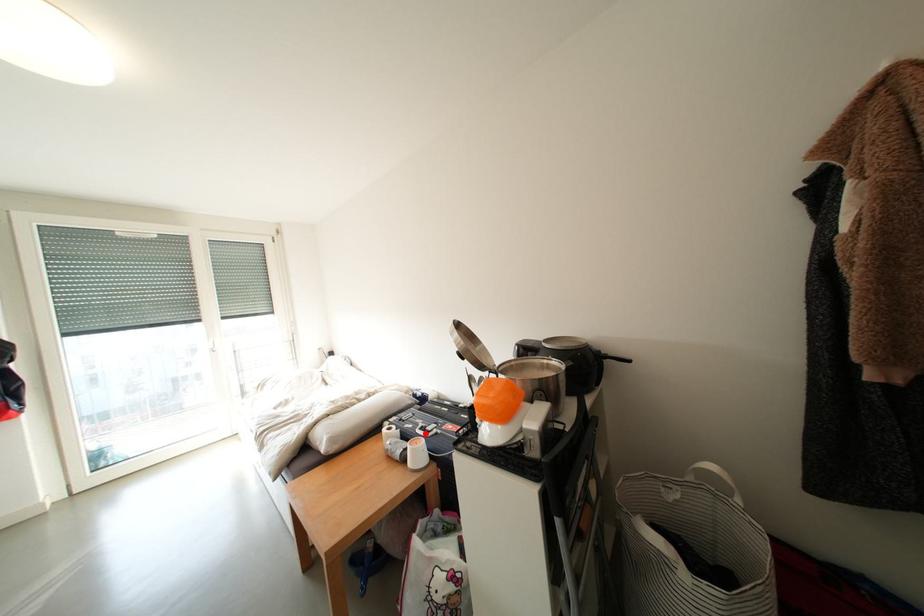
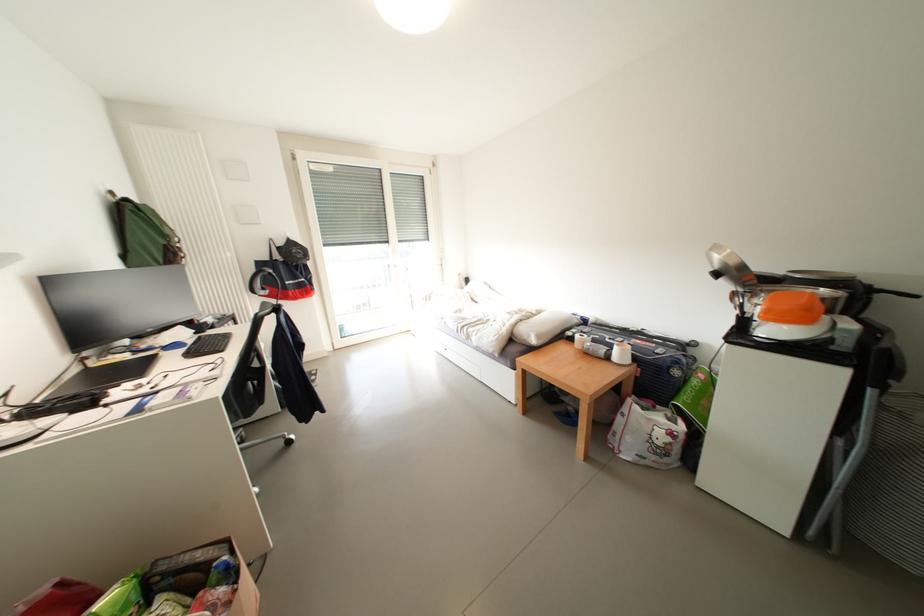
Find the pixel in the second image that matches the highlighted location in the first image.

(614, 342)